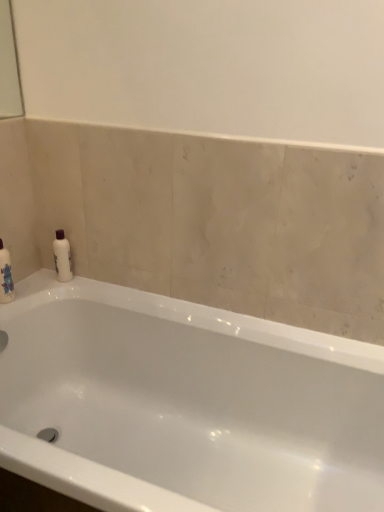
Identify the location of free space in front of white glossy bottle at upper left. This screenshot has height=512, width=384. (55, 286).